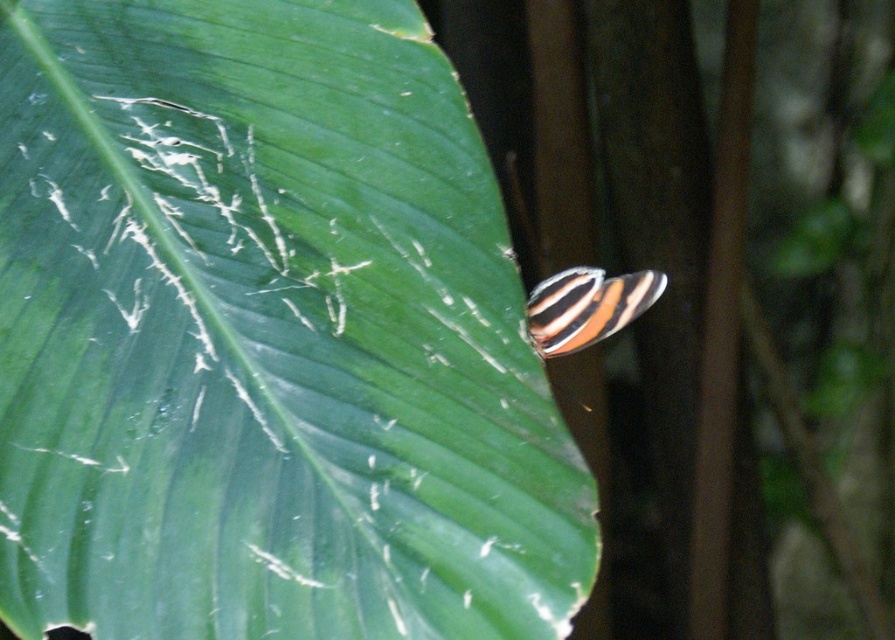
You are an entomologist observing a leaf and an insect. The leaf is green matte leaf at upper left and the insect is striped winged insect at center. Which object is taller?

The green matte leaf at upper left is taller than the striped winged insect at center.

You are an entomologist observing a leaf and an insect. You notice that the green matte leaf at upper left and the striped winged insect at center are positioned in a way that one is closer to you. Which object is closer to you?

The green matte leaf at upper left is closer to you because it is in front of the striped winged insect at center.